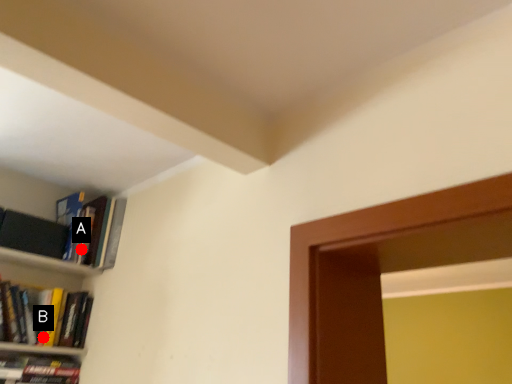
Question: Two points are circled on the image, labeled by A and B beside each circle. Which point appears closest to the camera in this image?

Choices:
 (A) A is closer
 (B) B is closer

Answer: (B)